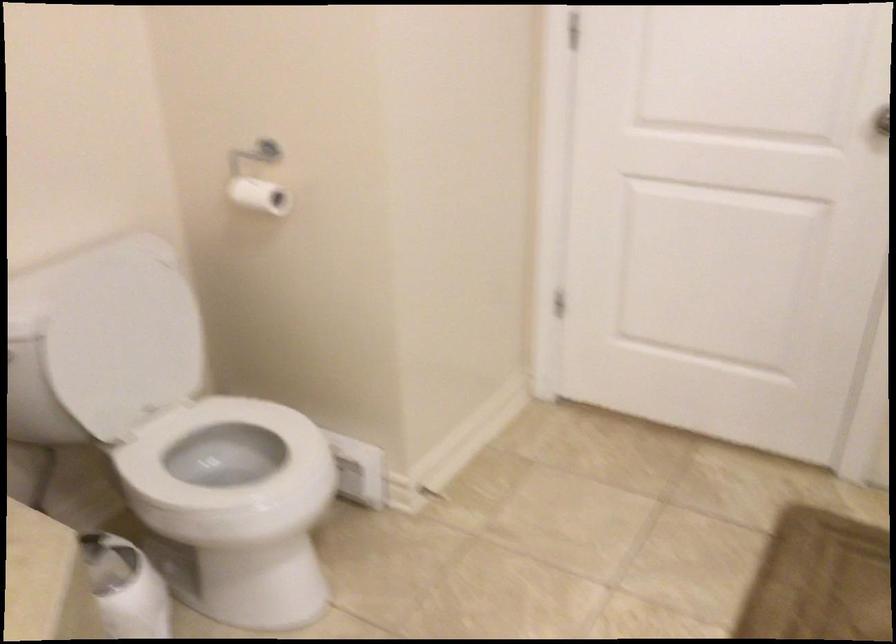
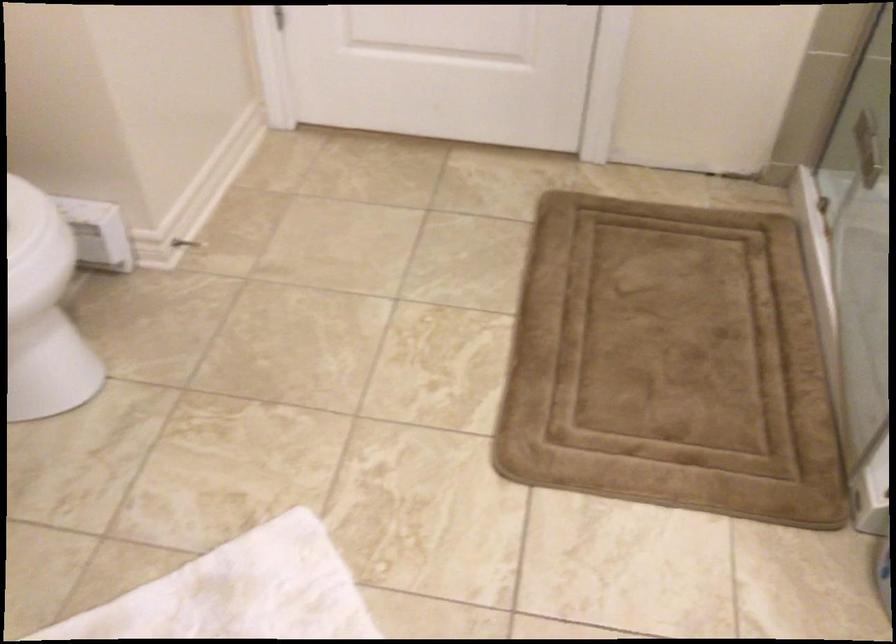
The images are taken continuously from a first-person perspective. In which direction is your viewpoint rotating?

The camera's rotation is toward right-down.